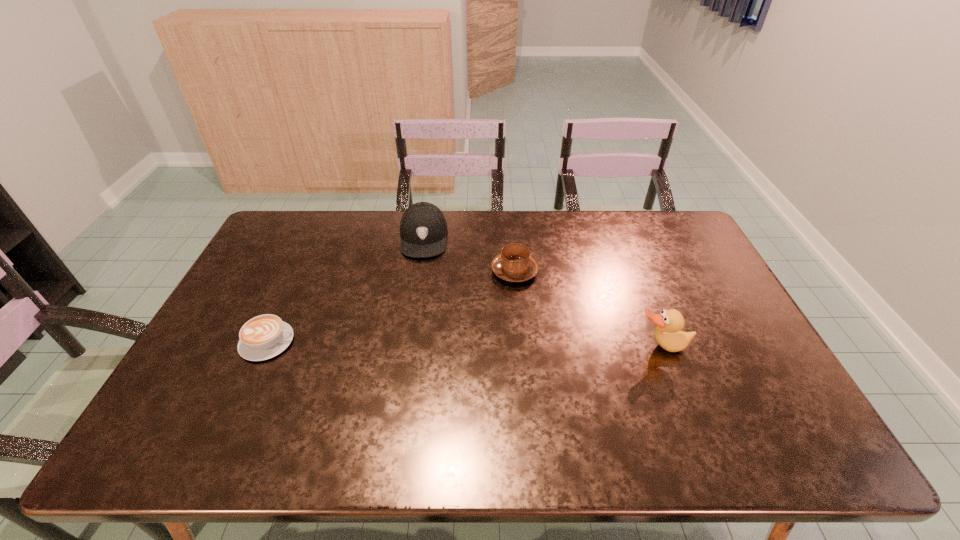
The height and width of the screenshot is (540, 960). I want to click on the left cappuccino, so click(265, 336).

The image size is (960, 540). In order to click on the shortest object in this screenshot , I will do point(265,336).

Locate an element on the screen. This screenshot has width=960, height=540. duck is located at coordinates (668, 333).

Locate an element on the screen. the rightmost object is located at coordinates (668, 333).

The height and width of the screenshot is (540, 960). In order to click on the third tallest object in this screenshot , I will do `click(515, 264)`.

At what (x,y) coordinates should I click in order to perform the action: click on the second object from right to left. Please return your answer as a coordinate pair (x, y). Image resolution: width=960 pixels, height=540 pixels. Looking at the image, I should click on (515, 264).

At what (x,y) coordinates should I click in order to perform the action: click on cap. Please return your answer as a coordinate pair (x, y). The height and width of the screenshot is (540, 960). Looking at the image, I should click on (423, 228).

The image size is (960, 540). Identify the location of the third object from right to left. (423, 228).

Find the location of a particular element. The height and width of the screenshot is (540, 960). vacant area located on the side of the leftmost object with the handle is located at coordinates click(383, 342).

The width and height of the screenshot is (960, 540). I want to click on blank space located on the beak of the rightmost object, so click(x=687, y=414).